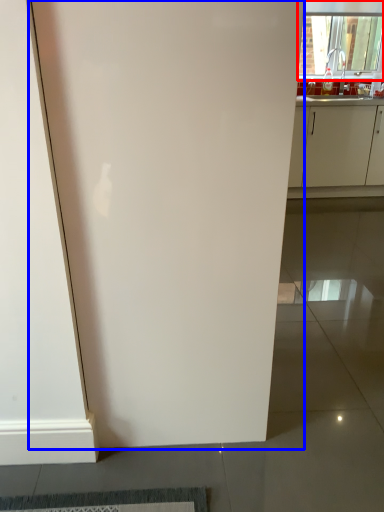
Question: Which of the following is the closest to the observer, window (highlighted by a red box) or door (highlighted by a blue box)?

Choices:
 (A) window
 (B) door

Answer: (B)